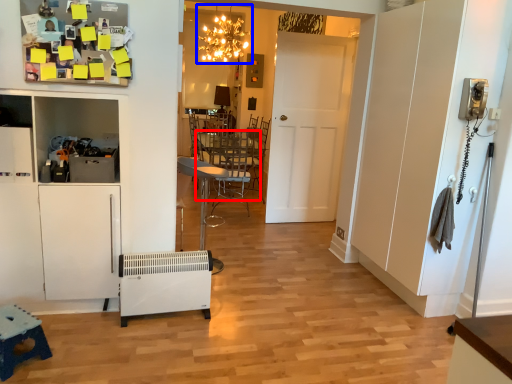
Question: Which object is further to the camera taking this photo, table (highlighted by a red box) or light fixture (highlighted by a blue box)?

Choices:
 (A) table
 (B) light fixture

Answer: (B)